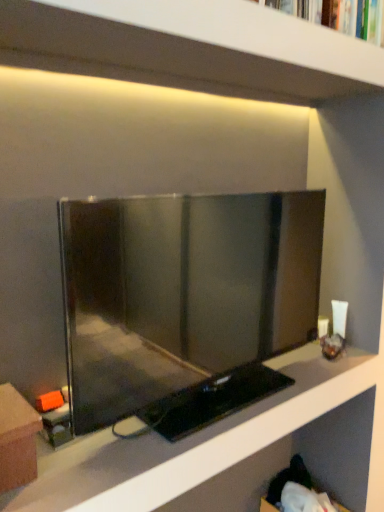
Locate an element on the screen. hardcover book at upper center is located at coordinates click(x=339, y=15).

Find the location of a particular element. This screenshot has height=512, width=384. white matte shelf at upper center, which ranks as the 2th shelf in bottom-to-top order is located at coordinates point(190,47).

Locate an element on the screen. The image size is (384, 512). brown cardboard box at lower left is located at coordinates (17, 439).

Image resolution: width=384 pixels, height=512 pixels. I want to click on hardcover book at upper center, so click(x=339, y=15).

Could you tell me if brown cardboard box at lower left is facing hardcover book at upper center?

No, brown cardboard box at lower left is not aimed at hardcover book at upper center.

Is point (9, 406) positioned before point (320, 22)?

Yes, point (9, 406) is closer to viewer.

Looking at their sizes, would you say brown cardboard box at lower left is wider or thinner than hardcover book at upper center?

brown cardboard box at lower left is wider than hardcover book at upper center.

From a real-world perspective, is matte black tv at center, arranged as the 1th shelf when ordered from the bottom, positioned over white matte shelf at upper center, which ranks as the 2th shelf in bottom-to-top order, based on gravity?

No, from a real-world perspective, matte black tv at center, arranged as the 1th shelf when ordered from the bottom, is not on top of white matte shelf at upper center, which ranks as the 2th shelf in bottom-to-top order.

Which object is wider, matte black tv at center, arranged as the 1th shelf when ordered from the bottom, or white matte shelf at upper center, the first shelf in the top-to-bottom sequence?

matte black tv at center, arranged as the 1th shelf when ordered from the bottom, is wider.

Between point (95, 442) and point (253, 74), which one is positioned in front?

The point (95, 442) is in front.

How many degrees apart are the facing directions of matte black tv at center, arranged as the 1th shelf when ordered from the bottom, and white matte shelf at upper center, the first shelf in the top-to-bottom sequence?

The facing directions of matte black tv at center, arranged as the 1th shelf when ordered from the bottom, and white matte shelf at upper center, the first shelf in the top-to-bottom sequence, are 0.000172 degrees apart.

Does matte black tv at center turn towards hardcover book at upper center?

No, matte black tv at center does not turn towards hardcover book at upper center.

From the image's perspective, is matte black tv at center on hardcover book at upper center?

Incorrect, from the image's perspective, matte black tv at center is lower than hardcover book at upper center.

Locate an element on the screen. This screenshot has height=512, width=384. book above the matte black tv at center (from the image's perspective) is located at coordinates (339, 15).

Is matte black tv at center next to hardcover book at upper center?

No.

Can you tell me how much brown cardboard box at lower left and matte black tv at center differ in facing direction?

The angular difference between brown cardboard box at lower left and matte black tv at center is 0.000402 degrees.

Is brown cardboard box at lower left turned away from matte black tv at center?

No, brown cardboard box at lower left's orientation is not away from matte black tv at center.

Can you see brown cardboard box at lower left touching matte black tv at center?

brown cardboard box at lower left is not next to matte black tv at center, and they're not touching.

Considering the sizes of brown cardboard box at lower left and matte black tv at center in the image, is brown cardboard box at lower left taller or shorter than matte black tv at center?

In the image, brown cardboard box at lower left appears to be shorter than matte black tv at center.

Considering the sizes of objects matte black tv at center and white matte shelf at upper center, the first shelf in the top-to-bottom sequence, in the image provided, who is shorter, matte black tv at center or white matte shelf at upper center, the first shelf in the top-to-bottom sequence,?

With less height is white matte shelf at upper center, the first shelf in the top-to-bottom sequence.

Are matte black tv at center and white matte shelf at upper center, the first shelf in the top-to-bottom sequence, far apart?

That's not correct — matte black tv at center is a little close to white matte shelf at upper center, the first shelf in the top-to-bottom sequence.

Is matte black tv at center turned away from white matte shelf at upper center, which ranks as the 2th shelf in bottom-to-top order?

No, matte black tv at center is not facing the opposite direction of white matte shelf at upper center, which ranks as the 2th shelf in bottom-to-top order.

In the image, is matte black tv at center on the left side or the right side of white matte shelf at upper center, the first shelf in the top-to-bottom sequence?

Based on their positions, matte black tv at center is located to the left of white matte shelf at upper center, the first shelf in the top-to-bottom sequence.

In the scene shown: From a real-world perspective, relative to matte black tv at center, arranged as the 1th shelf when ordered from the bottom, is hardcover book at upper center vertically above or below?

Clearly, from a real-world perspective, hardcover book at upper center is above matte black tv at center, arranged as the 1th shelf when ordered from the bottom.

Is hardcover book at upper center positioned far away from matte black tv at center, which is the 2th shelf in top-to-bottom order?

Yes, hardcover book at upper center is far from matte black tv at center, which is the 2th shelf in top-to-bottom order.

Is hardcover book at upper center outside of matte black tv at center, arranged as the 1th shelf when ordered from the bottom?

Yes, hardcover book at upper center is not within matte black tv at center, arranged as the 1th shelf when ordered from the bottom.

Can you confirm if hardcover book at upper center is positioned to the right of matte black tv at center, which is the 2th shelf in top-to-bottom order?

Yes, hardcover book at upper center is to the right of matte black tv at center, which is the 2th shelf in top-to-bottom order.

Between white matte shelf at upper center, the first shelf in the top-to-bottom sequence, and brown cardboard box at lower left, which one has larger width?

white matte shelf at upper center, the first shelf in the top-to-bottom sequence.

Is white matte shelf at upper center, which ranks as the 2th shelf in bottom-to-top order, positioned with its back to brown cardboard box at lower left?

white matte shelf at upper center, which ranks as the 2th shelf in bottom-to-top order, does not have its back to brown cardboard box at lower left.

The image size is (384, 512). In order to click on furniture that appears behind the white matte shelf at upper center, the first shelf in the top-to-bottom sequence in this screenshot , I will do `click(17, 439)`.

Find the location of a particular element. This screenshot has height=512, width=384. book on the right of brown cardboard box at lower left is located at coordinates (339, 15).

The width and height of the screenshot is (384, 512). What are the coordinates of `shelf below the white matte shelf at upper center, which ranks as the 2th shelf in bottom-to-top order (from a real-world perspective)` in the screenshot? It's located at (191, 443).

When comparing their distances from brown cardboard box at lower left, does matte black tv at center or white matte shelf at upper center, which ranks as the 2th shelf in bottom-to-top order, seem closer?

matte black tv at center.

When comparing their distances from hardcover book at upper center, does matte black tv at center or matte black tv at center, which is the 2th shelf in top-to-bottom order, seem closer?

Based on the image, matte black tv at center appears to be nearer to hardcover book at upper center.

Looking at the image, which one is located further to matte black tv at center, hardcover book at upper center or matte black tv at center, which is the 2th shelf in top-to-bottom order?

The object further to matte black tv at center is hardcover book at upper center.

Which object lies nearer to the anchor point matte black tv at center, which is the 2th shelf in top-to-bottom order, hardcover book at upper center or brown cardboard box at lower left?

Based on the image, brown cardboard box at lower left appears to be nearer to matte black tv at center, which is the 2th shelf in top-to-bottom order.

When comparing their distances from matte black tv at center, which is the 2th shelf in top-to-bottom order, does matte black tv at center or white matte shelf at upper center, which ranks as the 2th shelf in bottom-to-top order, seem closer?

matte black tv at center.

Based on their spatial positions, is white matte shelf at upper center, which ranks as the 2th shelf in bottom-to-top order, or hardcover book at upper center further from matte black tv at center?

hardcover book at upper center lies further to matte black tv at center than the other object.

Considering their positions, is brown cardboard box at lower left positioned closer to hardcover book at upper center than matte black tv at center, which is the 2th shelf in top-to-bottom order?

Among the two, matte black tv at center, which is the 2th shelf in top-to-bottom order, is located nearer to hardcover book at upper center.

Based on their spatial positions, is hardcover book at upper center or matte black tv at center, arranged as the 1th shelf when ordered from the bottom, further from white matte shelf at upper center, the first shelf in the top-to-bottom sequence?

matte black tv at center, arranged as the 1th shelf when ordered from the bottom, is positioned further to the anchor white matte shelf at upper center, the first shelf in the top-to-bottom sequence.

Where is `shelf between hardcover book at upper center and matte black tv at center in the vertical direction`? Image resolution: width=384 pixels, height=512 pixels. shelf between hardcover book at upper center and matte black tv at center in the vertical direction is located at coordinates (190, 47).

This screenshot has height=512, width=384. Identify the location of shelf between hardcover book at upper center and brown cardboard box at lower left from top to bottom. (190, 47).

Locate an element on the screen. television between hardcover book at upper center and matte black tv at center, which is the 2th shelf in top-to-bottom order, vertically is located at coordinates (182, 293).

At what (x,y) coordinates should I click in order to perform the action: click on television between hardcover book at upper center and brown cardboard box at lower left in the vertical direction. Please return your answer as a coordinate pair (x, y). Looking at the image, I should click on (182, 293).